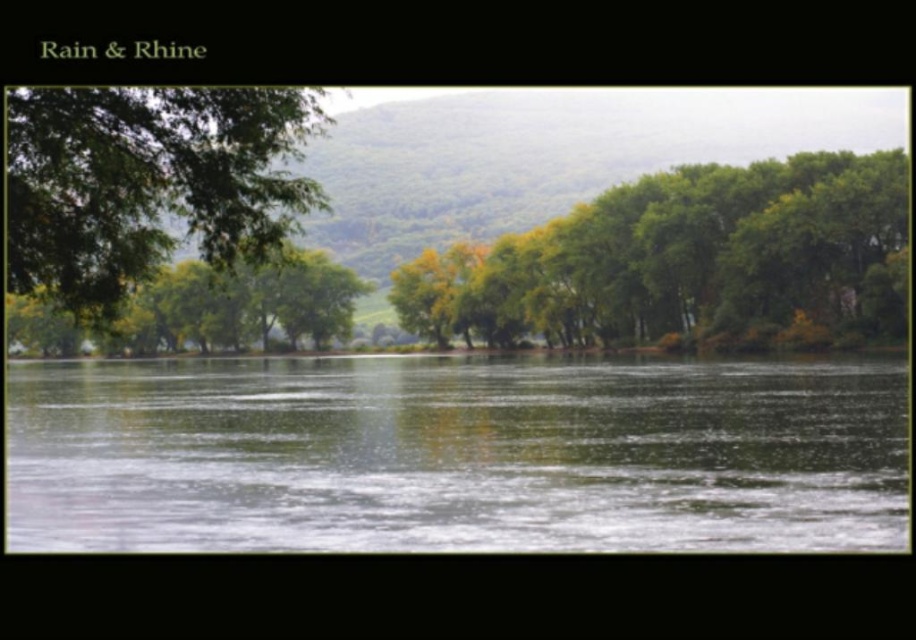
Between green reflective water at center and green leafy tree at left, which one appears on the left side from the viewer's perspective?

green leafy tree at left

Measure the distance from green reflective water at center to green leafy tree at left.

They are 40.17 meters apart.

In order to click on green reflective water at center in this screenshot , I will do `click(455, 454)`.

The height and width of the screenshot is (640, 916). In order to click on green leafy trees at center in this screenshot , I will do `click(688, 262)`.

Who is positioned more to the right, green leafy trees at center or green leafy tree at left?

Positioned to the right is green leafy trees at center.

Where is `green leafy trees at center`? This screenshot has width=916, height=640. green leafy trees at center is located at coordinates (688, 262).

Is green reflective water at center positioned in front of green leafy trees at center?

Yes, green reflective water at center is closer to the viewer.

Between green reflective water at center and green leafy trees at center, which one is positioned lower?

green reflective water at center is below.

This screenshot has width=916, height=640. What do you see at coordinates (455, 454) in the screenshot?
I see `green reflective water at center` at bounding box center [455, 454].

You are a GUI agent. You are given a task and a screenshot of the screen. Output one action in this format:
    pyautogui.click(x=<x>, y=<y>)
    Task: Click on the green reflective water at center
    
    Given the screenshot: What is the action you would take?
    pyautogui.click(x=455, y=454)